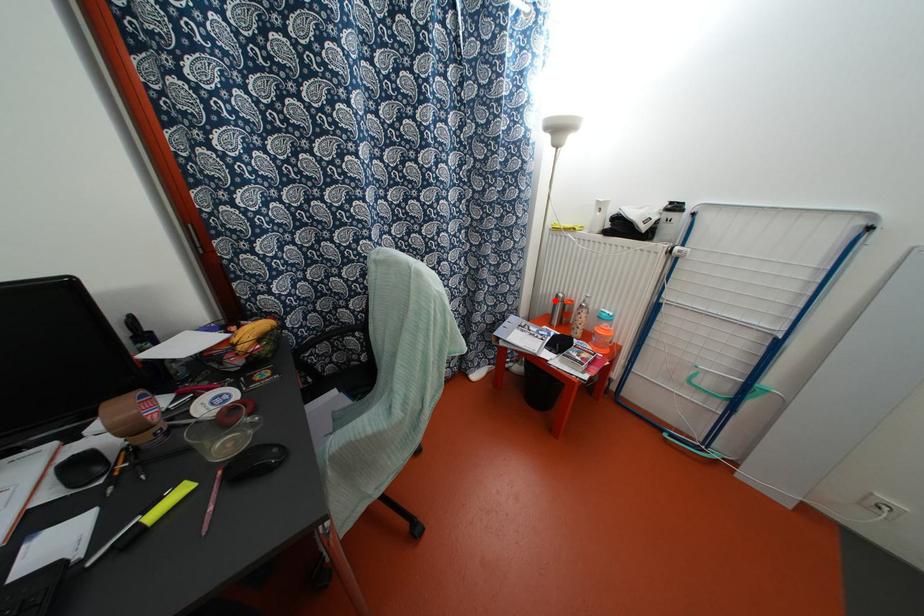
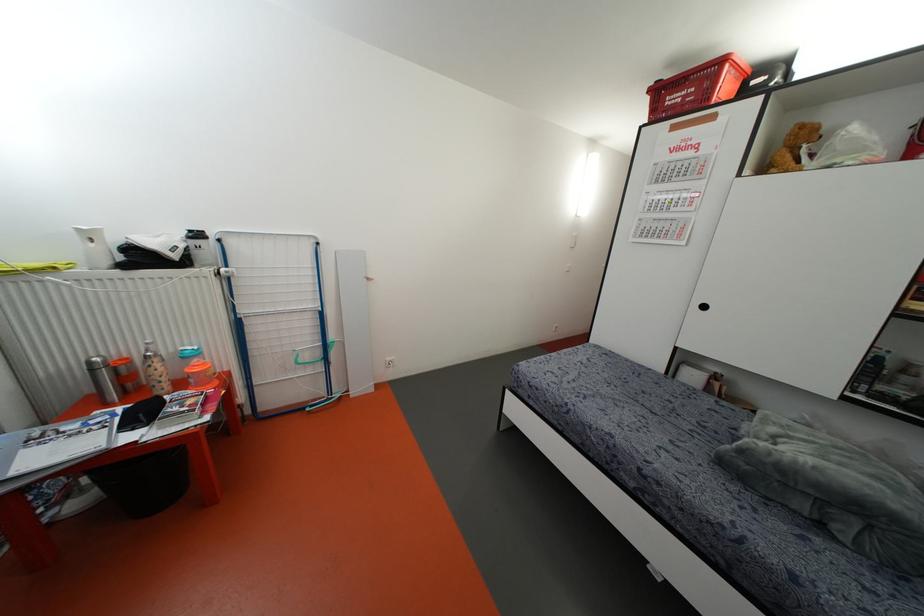
Question: A red point is marked in image1. In image2, is the corresponding 3D point closer to the camera or farther? Reply with the corresponding letter.

Choices:
 (A) The corresponding 3D point is closer.
 (B) The corresponding 3D point is farther.

Answer: (B)